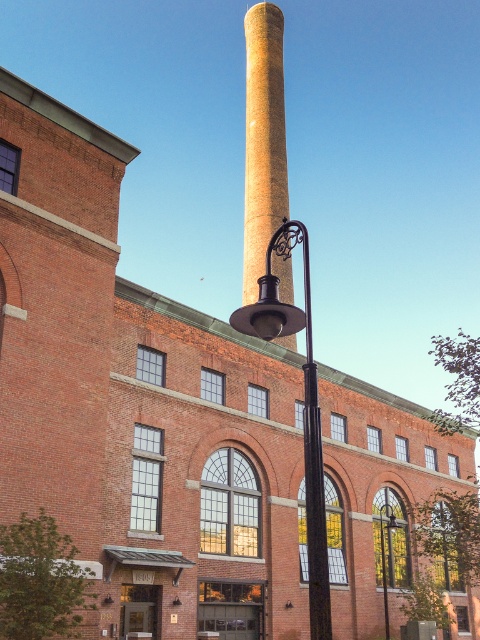
You are standing at the entrance of the historic brick building and see the polished brass lamp post at center. If you walk straight ahead towards the lamppost, will you be moving towards the building or away from it?

The polished brass lamp post at center is located in the foreground of the scene, so walking straight ahead towards it would mean moving away from the building itself.

You are an architect designing a new lighting plan for the historic brick building. You have two options for a central lamppost, the polished brass lamp post at center and the matte black lamp post at center. Considering the building has a symmetrical facade with evenly spaced windows and a light colored chimney, which lamp post would you choose to maintain visual harmony?

The polished brass lamp post at center is positioned over the matte black lamp post at center, so it would better complement the light colored chimney and warm brick tones of the building.

Consider the image. You are a photographer planning to take a picture of the yellowish brick chimney at center and the matte black lamp post at center. Since you want both objects to appear clearly in the photo, which one should you focus on first to ensure proper focus?

You should focus on the yellowish brick chimney at center first because it is larger in size than the matte black lamp post at center, making it more prominent and requiring precise focus.